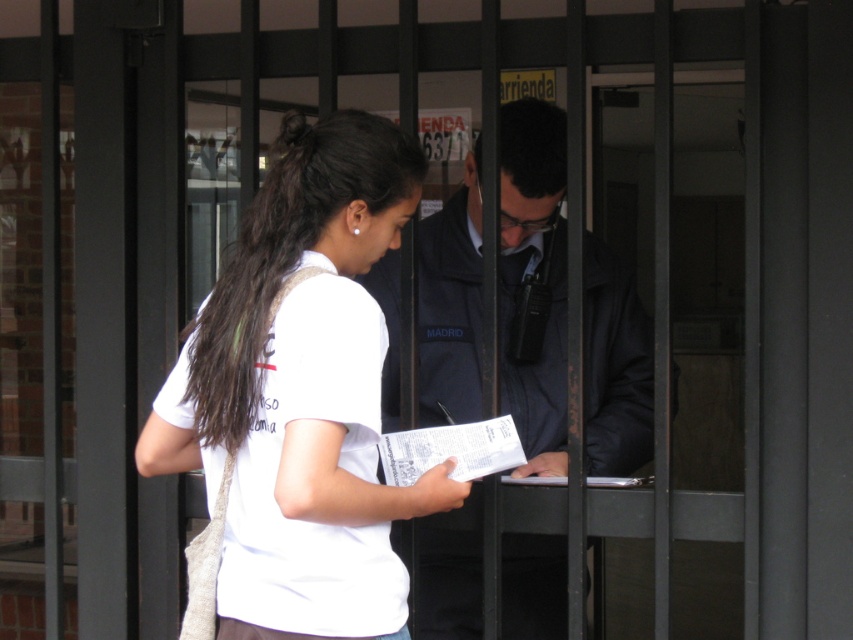
Question: Is dark blue uniform at center closer to camera compared to dark brown hair at center?

Choices:
 (A) no
 (B) yes

Answer: (A)

Question: Which point appears farthest from the camera in this image?

Choices:
 (A) (219, 376)
 (B) (502, 224)

Answer: (B)

Question: Which point is closer to the camera?

Choices:
 (A) dark brown hair at center
 (B) dark blue uniform at center

Answer: (A)

Question: Which point is closer to the camera?

Choices:
 (A) dark blue uniform at center
 (B) dark brown hair at center
 (C) white matte shirt at center

Answer: (C)

Question: Is dark blue uniform at center to the left of dark brown hair at center from the viewer's perspective?

Choices:
 (A) yes
 (B) no

Answer: (B)

Question: Does dark blue uniform at center appear over dark brown hair at center?

Choices:
 (A) yes
 (B) no

Answer: (B)